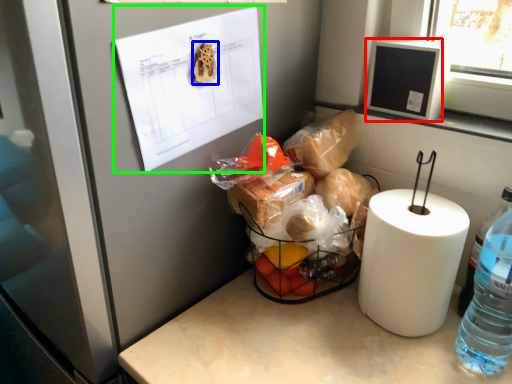
Question: Which is nearer to the window screen (highlighted by a red box)? food (highlighted by a blue box) or paper (highlighted by a green box).

Choices:
 (A) food
 (B) paper

Answer: (B)